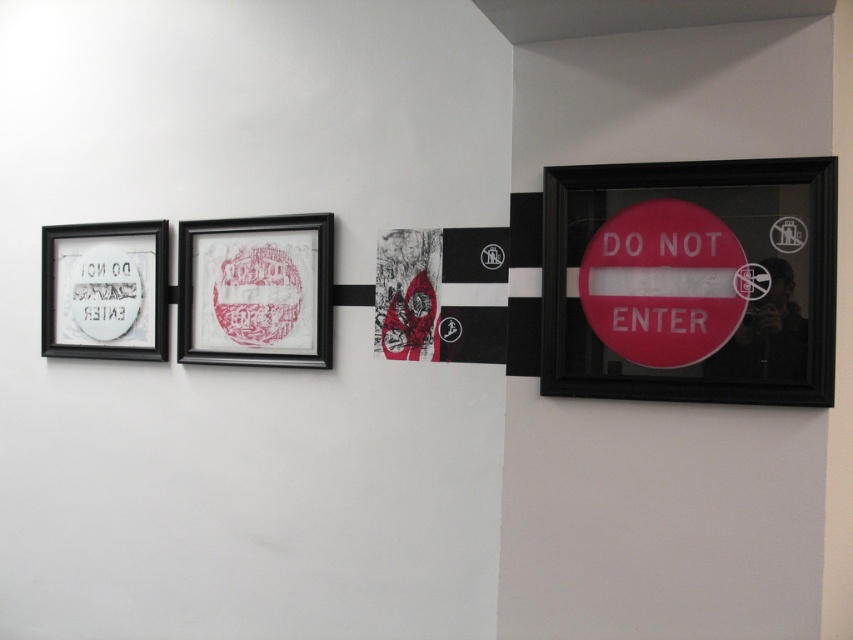
Is red glossy sign at right below matte paper picture frame at center?

Correct, red glossy sign at right is located below matte paper picture frame at center.

Does red glossy sign at right have a larger size compared to matte paper picture frame at center?

Actually, red glossy sign at right might be smaller than matte paper picture frame at center.

Does point (640, 214) lie behind point (328, 250)?

No, (640, 214) is closer to viewer.

The image size is (853, 640). Identify the location of red glossy sign at right. (663, 284).

How distant is matte paper picture frame at center from red textured fabric at center?

matte paper picture frame at center and red textured fabric at center are 12.37 inches apart from each other.

Can you confirm if matte paper picture frame at center is positioned above red textured fabric at center?

Indeed, matte paper picture frame at center is positioned over red textured fabric at center.

Describe the element at coordinates (256, 291) in the screenshot. The width and height of the screenshot is (853, 640). I see `matte paper picture frame at center` at that location.

Identify the location of matte paper picture frame at center. This screenshot has height=640, width=853. (256, 291).

Who is shorter, matte plastic sign at right or red textured fabric at center?

red textured fabric at center is shorter.

Between point (550, 353) and point (374, 301), which one is positioned in front?

Positioned in front is point (550, 353).

Identify the location of matte plastic sign at right. The height and width of the screenshot is (640, 853). (691, 282).